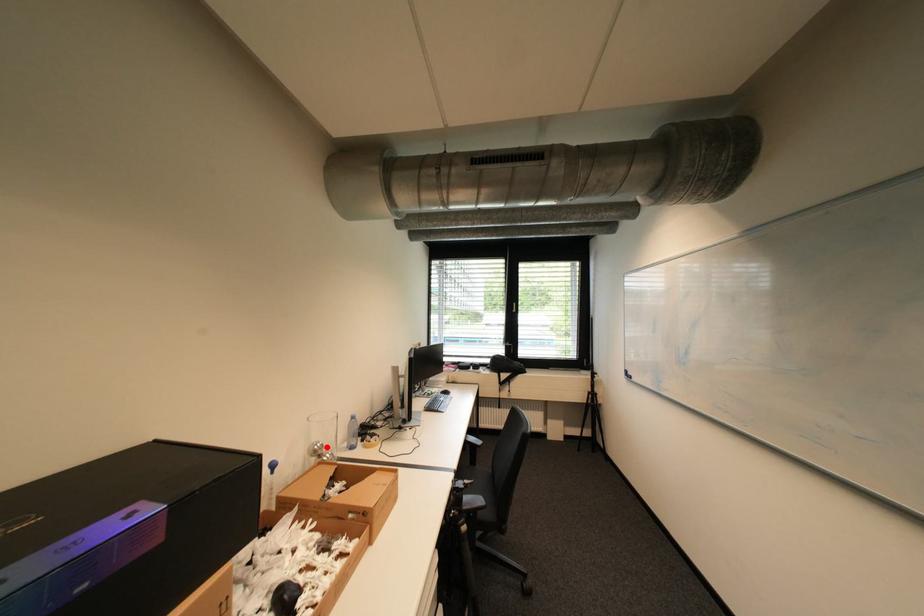
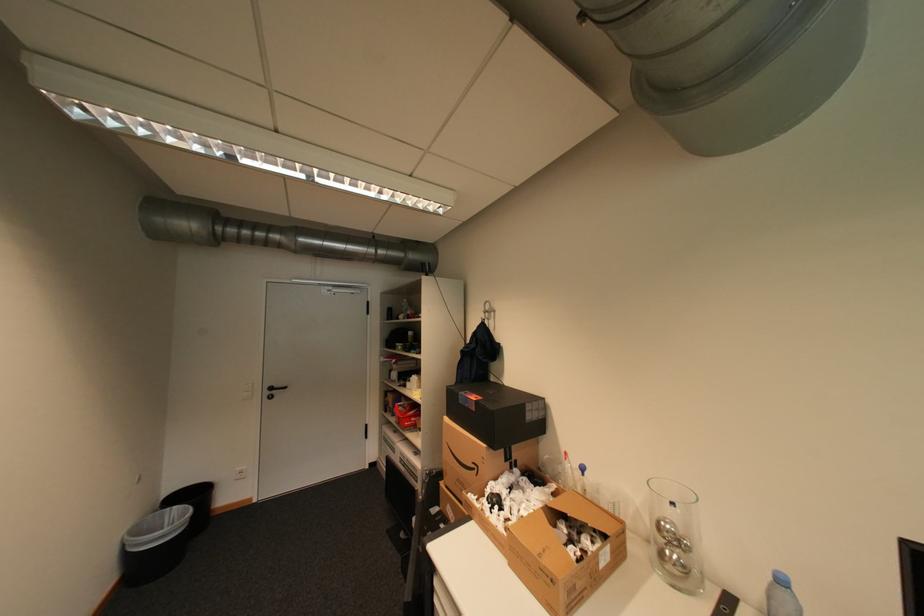
Find the pixel in the second image that matches the highlighted location in the first image.

(673, 527)